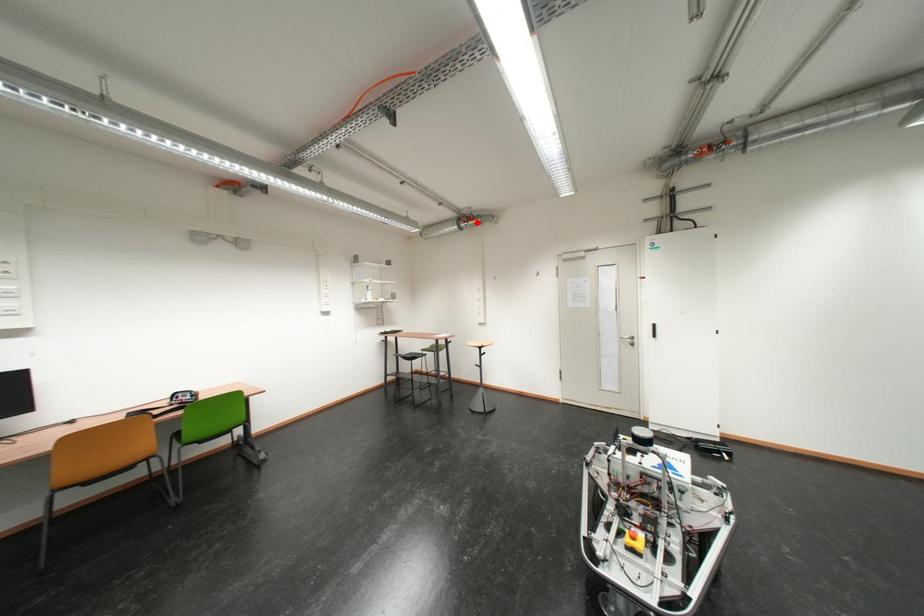
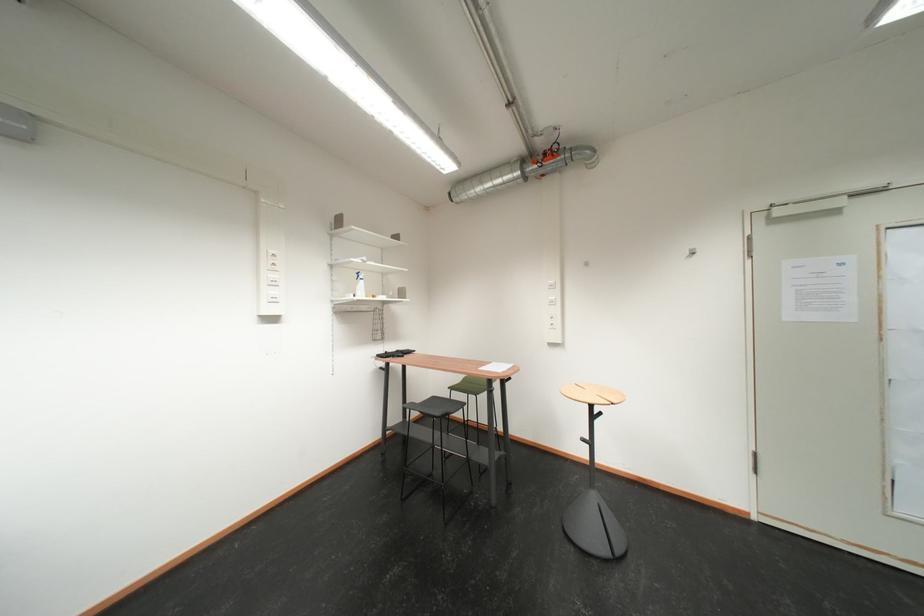
Where in the second image is the point corresponding to the highlighted location from the first image?

(552, 160)